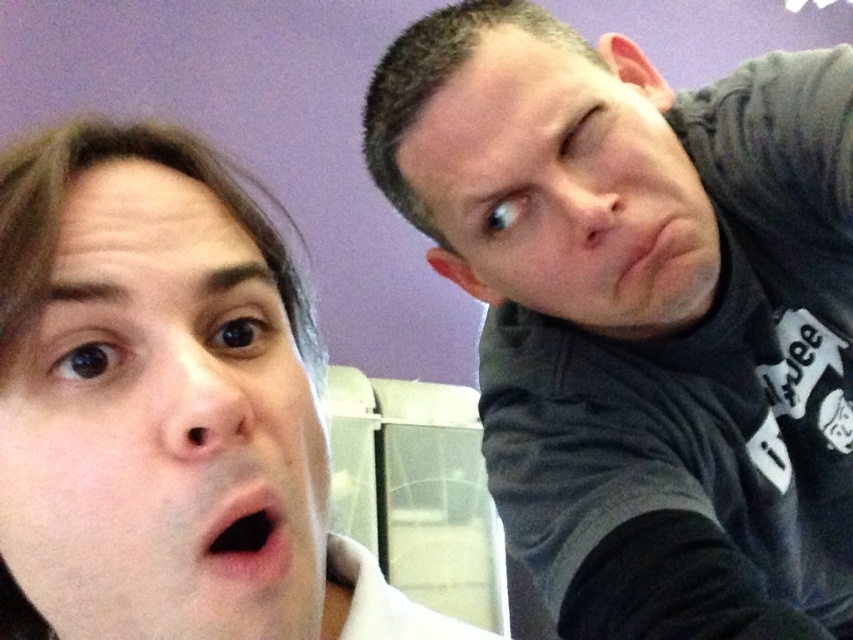
You are a photographer setting up a camera 12 inches away from the dark gray hoodie at upper right. Can you also capture the smooth skin face at left in the same frame without moving the camera?

The dark gray hoodie at upper right and smooth skin face at left are 16.41 inches apart from each other. Since the camera is placed 12 inches away from the hoodie, the face is 4.41 inches beyond the camera range. Therefore, the smooth skin face at left would not be in the same frame unless the camera has a wide enough angle to cover 16.41 inches total distance.